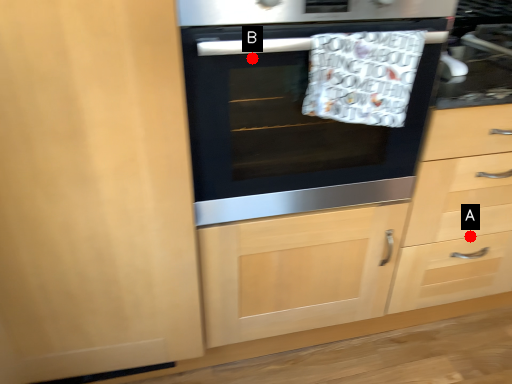
Question: Two points are circled on the image, labeled by A and B beside each circle. Which point is farther to the camera?

Choices:
 (A) A is further
 (B) B is further

Answer: (A)